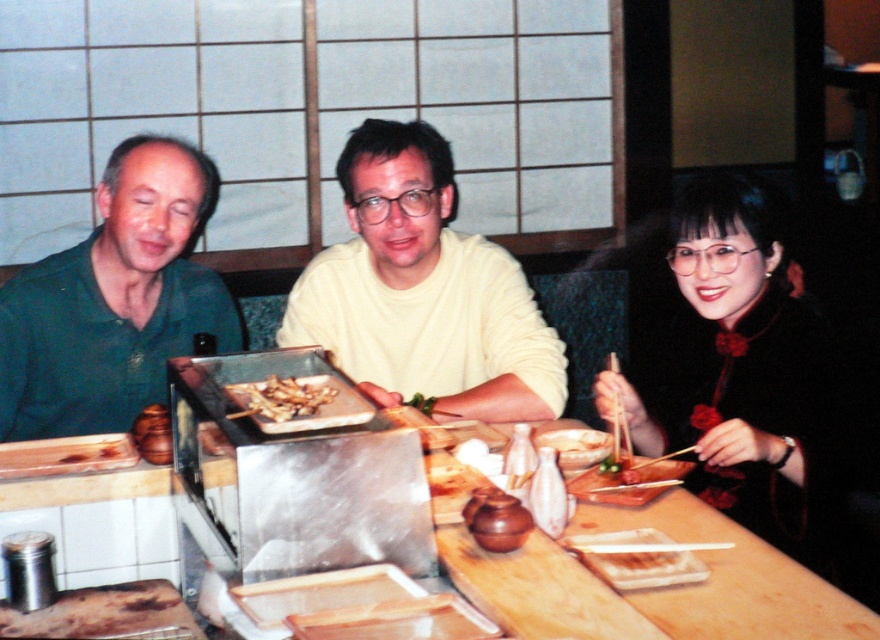
What is located at the coordinates point (423,291)?

The yellow matte sweater at center is located at point (423,291).

You are a photographer at the event and need to capture a closeup of the brown glossy meat at center without including the black velvet dress at right in the frame. Is this possible given their positions?

The black velvet dress at right is above the brown glossy meat at center, so to avoid including the black velvet dress at right in the frame, you would need to angle the camera downward to focus solely on the brown glossy meat at center below it.